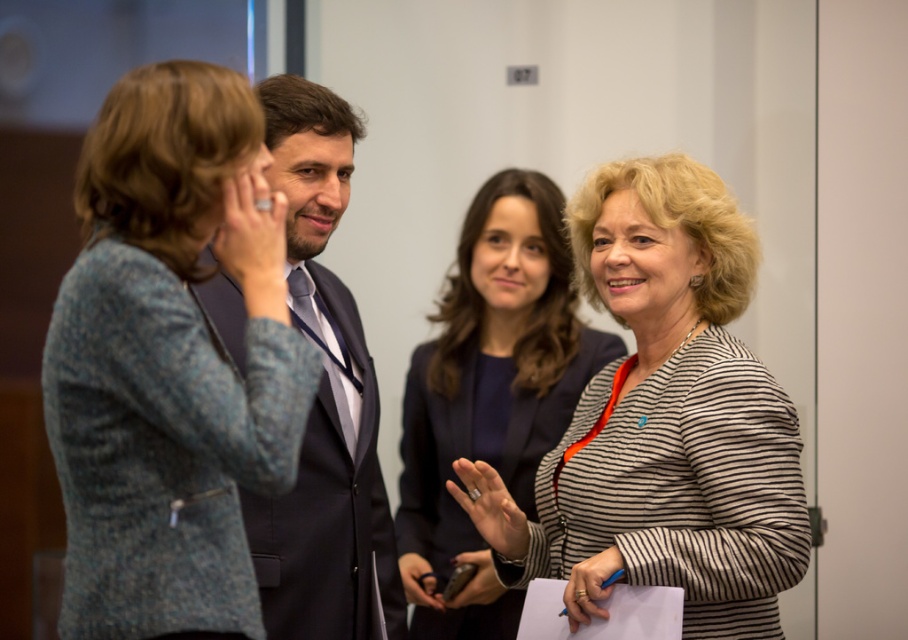
You are an interior designer assessing the layout of this office space. You notice the textured gray blazer at left and the striped fabric at center. Which object is positioned higher in the image?

The textured gray blazer at left is located above striped fabric at center, so it is positioned higher in the image.

You are an interior designer observing this professional setting. You need to determine the arrangement of the striped fabric at center and the dark gray suit at center. Which object is positioned lower in the scene?

The striped fabric at center is located below dark gray suit at center, so the striped fabric at center is positioned lower in the scene.

You are an interior designer assessing the layout of this office scene. You notice the striped fabric at center and the dark gray suit at center. Which object is wider?

The striped fabric at center is wider than the dark gray suit at center.